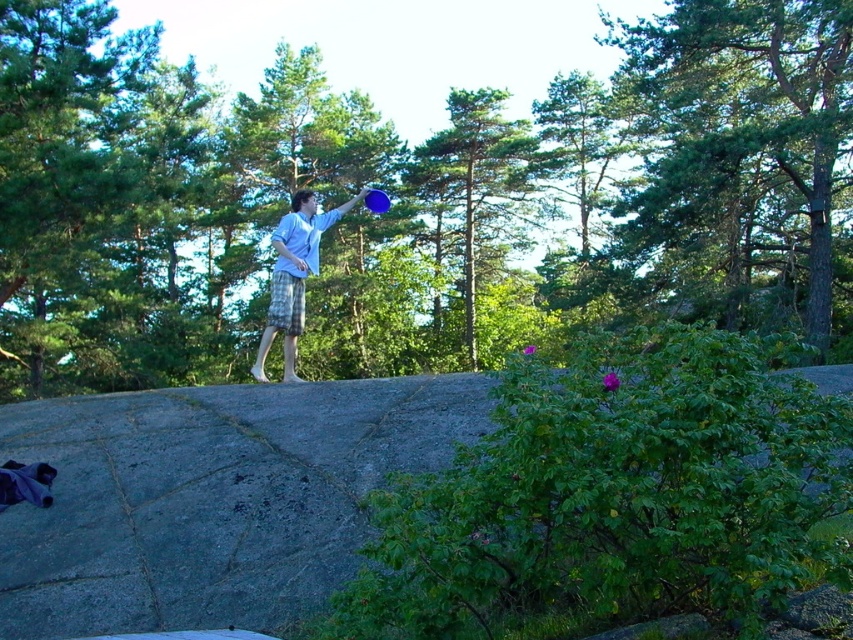
Question: Estimate the real-world distances between objects in this image. Which object is farther from the green leafy tree at upper right?

Choices:
 (A) green leafy tree at center
 (B) green leafy bush at center

Answer: (A)

Question: Does green leafy tree at upper right have a smaller size compared to green leafy tree at center?

Choices:
 (A) no
 (B) yes

Answer: (A)

Question: Is green leafy tree at center bigger than white cotton shirt at center?

Choices:
 (A) yes
 (B) no

Answer: (A)

Question: Which of these objects is positioned closest to the green leafy bush at center?

Choices:
 (A) green leafy tree at center
 (B) green leafy tree at upper right
 (C) white cotton shirt at center

Answer: (A)

Question: Which object is the farthest from the green leafy tree at center?

Choices:
 (A) blue plastic frisbee at upper center
 (B) green leafy tree at upper right

Answer: (A)

Question: From the image, what is the correct spatial relationship of white cotton shirt at center in relation to blue plastic frisbee at upper center?

Choices:
 (A) right
 (B) left

Answer: (B)